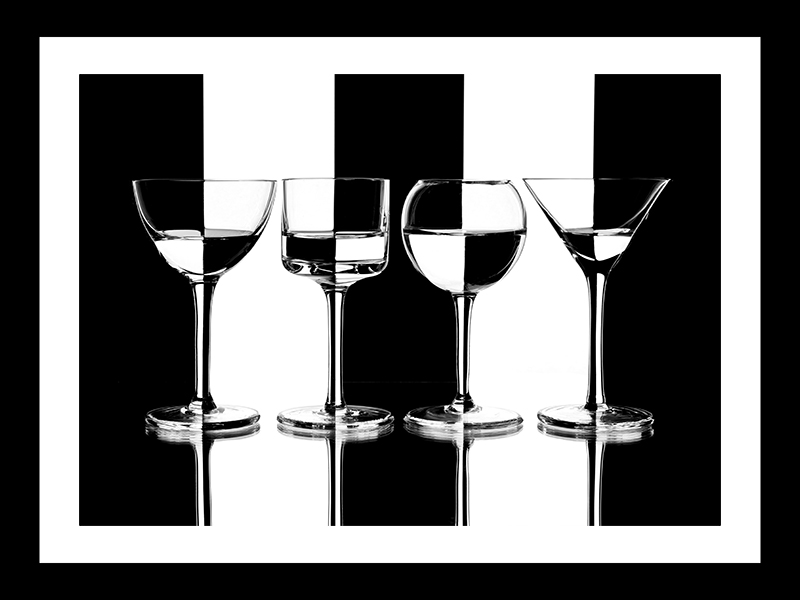
The image size is (800, 600). I want to click on wine glasses, so click(x=210, y=230), click(x=330, y=230), click(x=468, y=223), click(x=600, y=225).